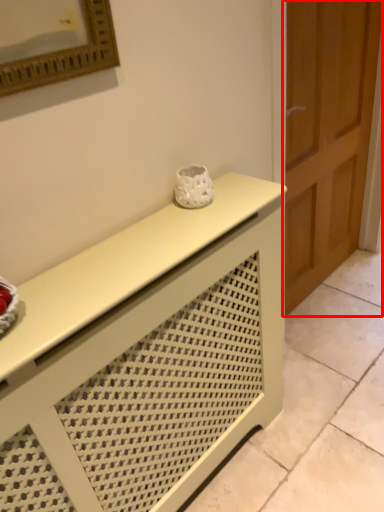
Question: Observing the image, what is the correct spatial positioning of door (annotated by the red box) in reference to furniture?

Choices:
 (A) left
 (B) right

Answer: (B)